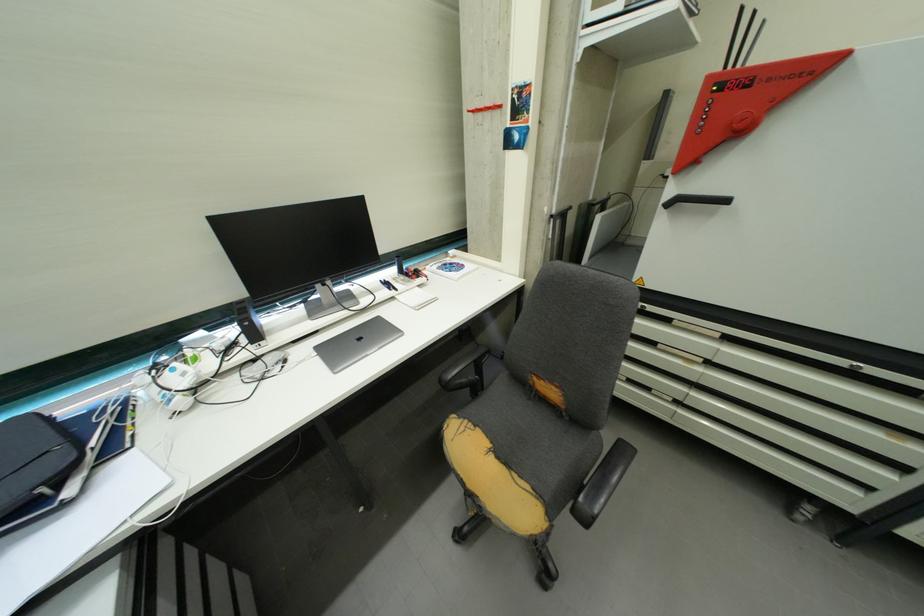
Locate an element on the screen. chair sitting surface is located at coordinates (x=525, y=440).